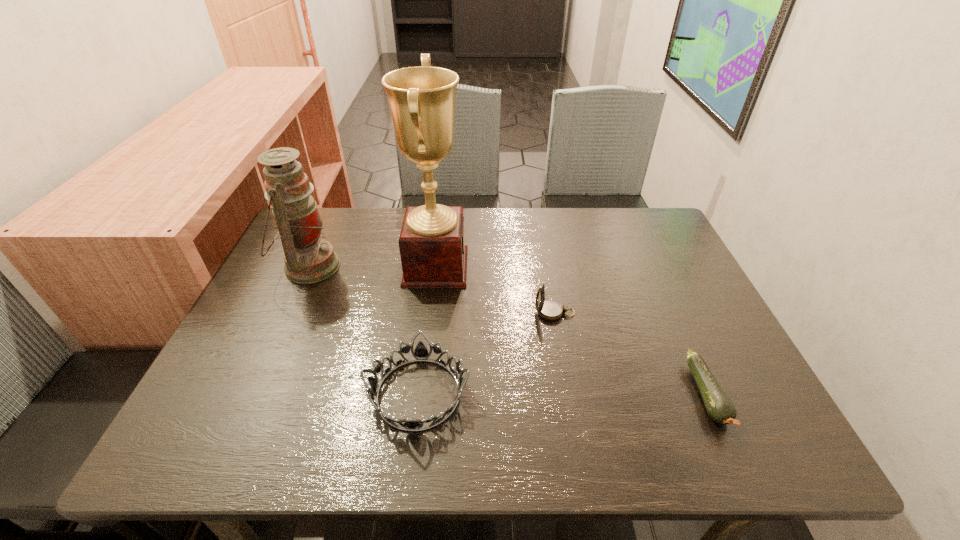
This screenshot has height=540, width=960. I want to click on blank space located on the face of the third farthest object, so click(x=506, y=313).

Identify the location of free spot located 0.180m on the face of the third farthest object. (460, 313).

At what (x,y) coordinates should I click in order to perform the action: click on vacant region located 0.100m on the face of the third farthest object. Please return your answer as a coordinate pair (x, y). The image size is (960, 540). Looking at the image, I should click on (493, 313).

Identify the location of free spot located on the front-facing side of the fourth tallest object. (569, 394).

The width and height of the screenshot is (960, 540). I want to click on trophy cup that is at the far edge, so click(422, 99).

Locate an element on the screen. Image resolution: width=960 pixels, height=540 pixels. oil lamp that is at the far edge is located at coordinates point(308,259).

At what (x,y) coordinates should I click in order to perform the action: click on tiara present at the near edge. Please return your answer as a coordinate pair (x, y). Looking at the image, I should click on (421, 353).

Where is `zucchini present at the near edge`? The height and width of the screenshot is (540, 960). zucchini present at the near edge is located at coordinates (719, 406).

Locate an element on the screen. The width and height of the screenshot is (960, 540). object situated at the left edge is located at coordinates (308, 259).

Locate an element on the screen. The image size is (960, 540). object that is at the right edge is located at coordinates click(x=719, y=406).